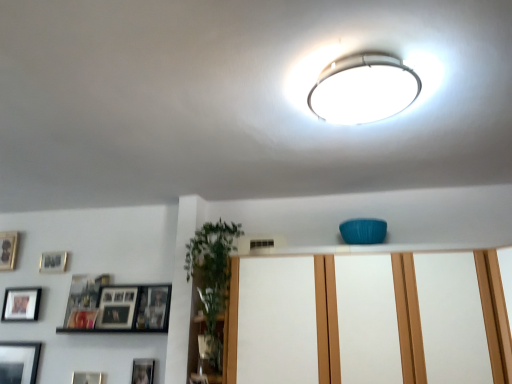
Question: Is matte black picture frame at upper left, which is the 3th picture frame in top-to-bottom order, taller than wooden photo frame at left, positioned as the 1th picture frame in top-to-bottom order?

Choices:
 (A) yes
 (B) no

Answer: (B)

Question: Is matte black picture frame at upper left, which ranks as the fourth picture frame in left-to-right order, wider than wooden photo frame at left, the 6th picture frame ordered from the bottom?

Choices:
 (A) no
 (B) yes

Answer: (B)

Question: Are matte black picture frame at upper left, which ranks as the fourth picture frame in left-to-right order, and wooden photo frame at left, which ranks as the sixth picture frame in right-to-left order, far apart?

Choices:
 (A) no
 (B) yes

Answer: (A)

Question: Would you say matte black picture frame at upper left, positioned as the fourth picture frame in bottom-to-top order, is outside wooden photo frame at left, which ranks as the sixth picture frame in right-to-left order?

Choices:
 (A) no
 (B) yes

Answer: (B)

Question: From the image's perspective, is matte black picture frame at upper left, the third picture frame viewed from the right, located beneath wooden photo frame at left, positioned as the 1th picture frame in top-to-bottom order?

Choices:
 (A) no
 (B) yes

Answer: (B)

Question: Considering their positions, is matte black picture frame at lower left, the 5th picture frame positioned from the left, located in front of or behind matte black picture frame at upper left, the third picture frame viewed from the right?

Choices:
 (A) front
 (B) behind

Answer: (A)

Question: Does point (73, 377) appear closer or farther from the camera than point (93, 307)?

Choices:
 (A) closer
 (B) farther

Answer: (A)

Question: Considering the positions of matte black picture frame at lower left, the 5th picture frame positioned from the left, and matte black picture frame at upper left, which is the 3th picture frame in top-to-bottom order, in the image, is matte black picture frame at lower left, the 5th picture frame positioned from the left, wider or thinner than matte black picture frame at upper left, which is the 3th picture frame in top-to-bottom order,?

Choices:
 (A) wide
 (B) thin

Answer: (B)

Question: From the image's perspective, relative to matte black picture frame at upper left, which ranks as the fourth picture frame in left-to-right order, is matte black picture frame at lower left, the 5th picture frame positioned from the left, above or below?

Choices:
 (A) above
 (B) below

Answer: (B)

Question: Looking at the image, does matte black picture frame at upper left, which ranks as the fourth picture frame in left-to-right order, seem bigger or smaller compared to matte black picture frame at lower left, which is the 4th picture frame in top-to-bottom order?

Choices:
 (A) small
 (B) big

Answer: (B)

Question: Considering the relative positions of matte black picture frame at upper left, the third picture frame viewed from the right, and matte black picture frame at lower left, which is counted as the fifth picture frame, starting from the right, in the image provided, is matte black picture frame at upper left, the third picture frame viewed from the right, to the left or to the right of matte black picture frame at lower left, which is counted as the fifth picture frame, starting from the right,?

Choices:
 (A) right
 (B) left

Answer: (A)

Question: Is point (83, 301) positioned closer to the camera than point (3, 316)?

Choices:
 (A) closer
 (B) farther

Answer: (A)

Question: From the image's perspective, is matte black picture frame at upper left, which ranks as the fourth picture frame in left-to-right order, above or below matte black picture frame at lower left, which is counted as the fifth picture frame, starting from the right?

Choices:
 (A) above
 (B) below

Answer: (A)

Question: Considering the positions of point (360, 369) and point (14, 238), is point (360, 369) closer or farther from the camera than point (14, 238)?

Choices:
 (A) farther
 (B) closer

Answer: (B)

Question: In the image, is matte white dresser at center on the left side or the right side of wooden photo frame at left, placed as the 1th picture frame when sorted from left to right?

Choices:
 (A) right
 (B) left

Answer: (A)